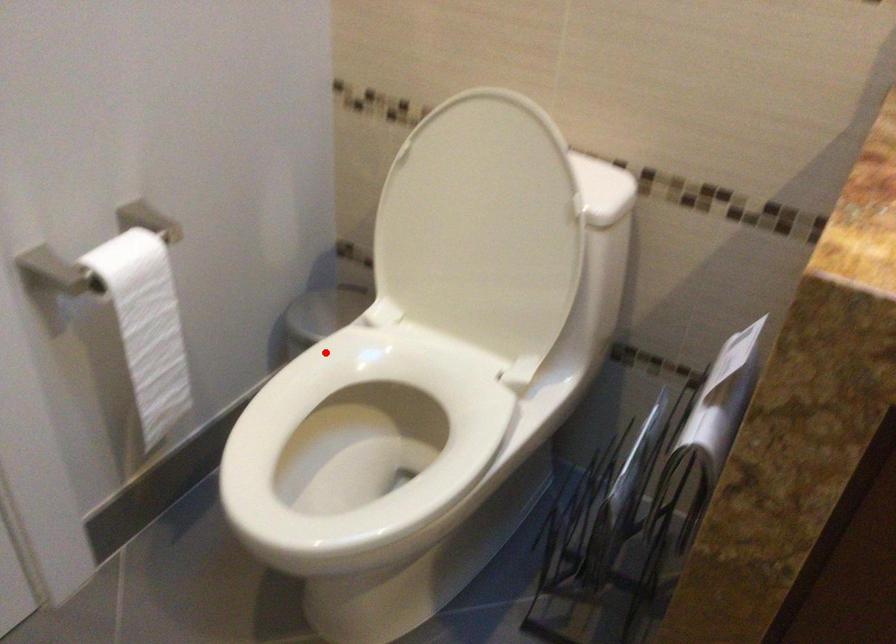
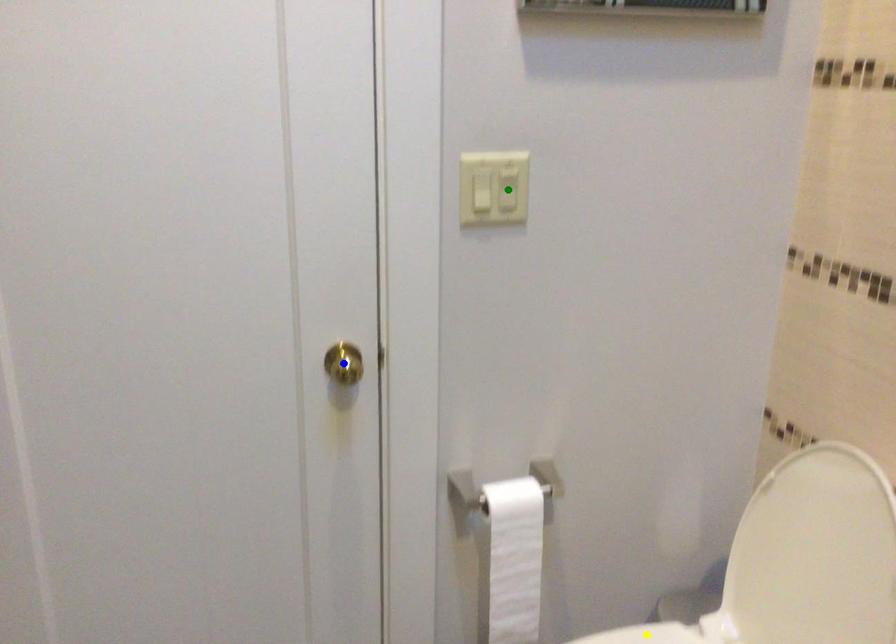
Question: I am providing you with two images of the same scene from different viewpoints. A red point is marked on the first image. You are given multiple points on the second image. Can you choose the point in image 2 that corresponds to the point in image 1?

Choices:
 (A) blue point
 (B) yellow point
 (C) green point

Answer: (B)